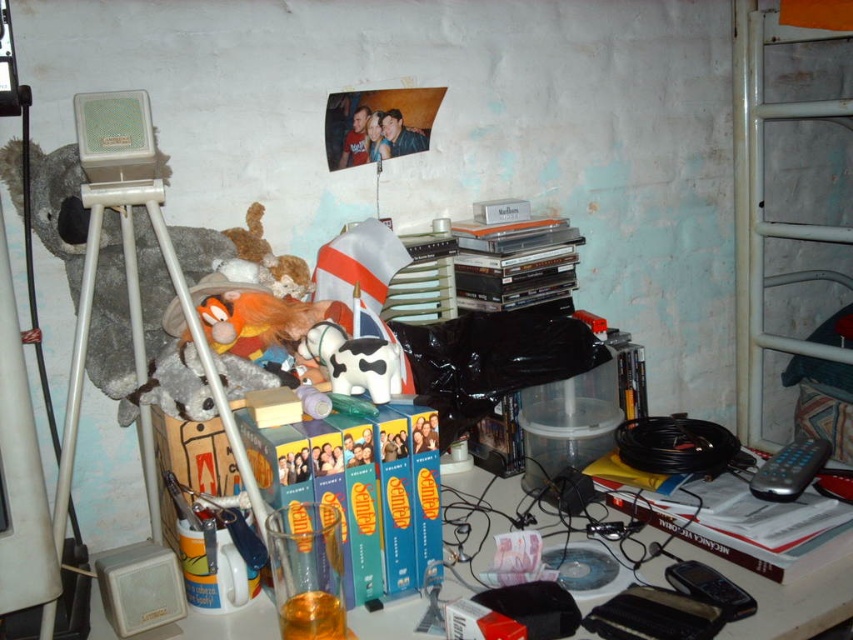
Question: Which point is farther from the camera taking this photo?

Choices:
 (A) pyautogui.click(x=316, y=324)
 (B) pyautogui.click(x=807, y=477)
 (C) pyautogui.click(x=349, y=616)

Answer: (B)

Question: Which of the following is the closest to the observer?

Choices:
 (A) (769, 490)
 (B) (384, 371)

Answer: (B)

Question: Does transparent plastic table at center appear on the left side of white matte cow at center?

Choices:
 (A) yes
 (B) no

Answer: (B)

Question: Is transparent plastic table at center bigger than black plastic remote control at lower right?

Choices:
 (A) yes
 (B) no

Answer: (A)

Question: Which of these objects is positioned closest to the black plastic remote control at lower right?

Choices:
 (A) transparent plastic table at center
 (B) white matte cow at center

Answer: (A)

Question: Does white matte cow at center appear over black plastic remote control at lower right?

Choices:
 (A) yes
 (B) no

Answer: (A)